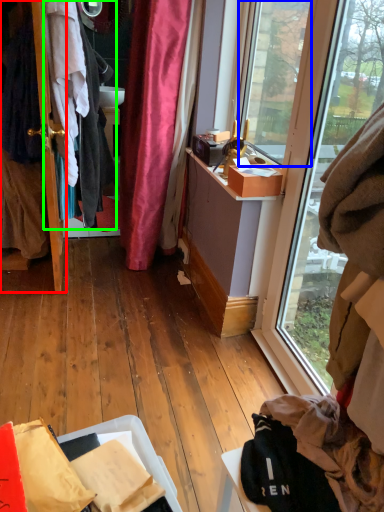
Question: Which object is the closest to the door (highlighted by a red box)? Choose among these: window screen (highlighted by a blue box) or clothing (highlighted by a green box).

Choices:
 (A) window screen
 (B) clothing

Answer: (B)